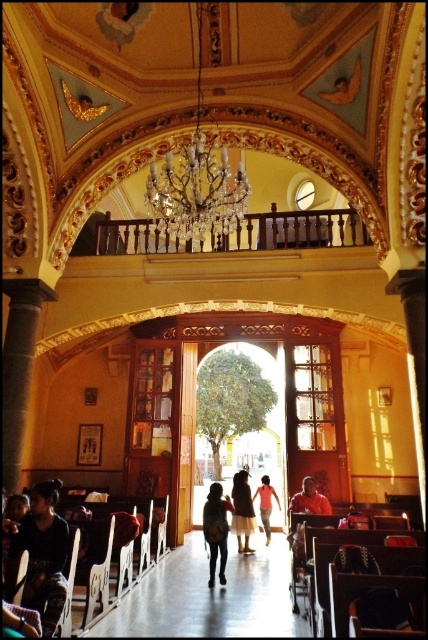
You are standing at the entrance of the grand building and see the wooden floor at center and the orange fabric person at center. Which object takes up more space in the image?

The wooden floor at center has a larger size compared to the orange fabric person at center, so it takes up more space in the image.

You are planning to place a new bench in the church that is wider than the wooden polished chair at lower left. If you want to place it where the orange fabric person at center is standing, will there be enough space?

The wooden polished chair at lower left has a lesser width compared to orange fabric person at center. Since the bench is wider than the chair, it may not fit in the space where the orange fabric person at center is standing unless the area is sufficiently wide to accommodate the larger width of the bench.